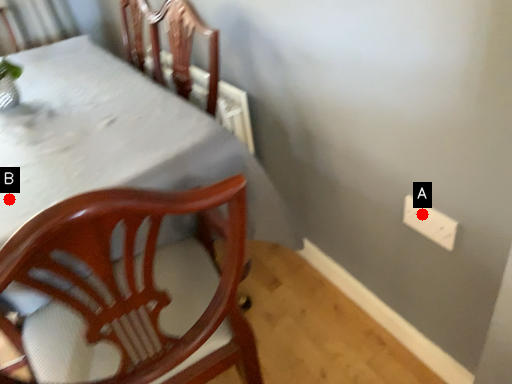
Question: Two points are circled on the image, labeled by A and B beside each circle. Which point appears closest to the camera in this image?

Choices:
 (A) A is closer
 (B) B is closer

Answer: (B)